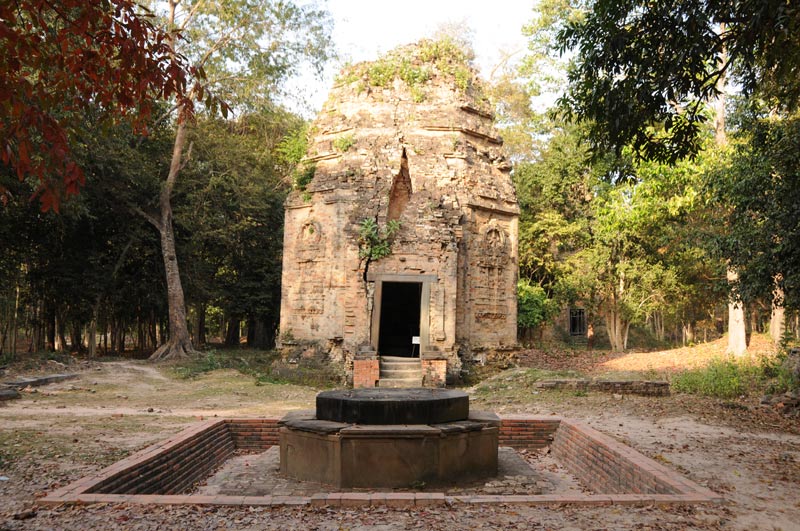
The width and height of the screenshot is (800, 531). What are the coordinates of `white chair inside doorway` in the screenshot? It's located at (417, 342).